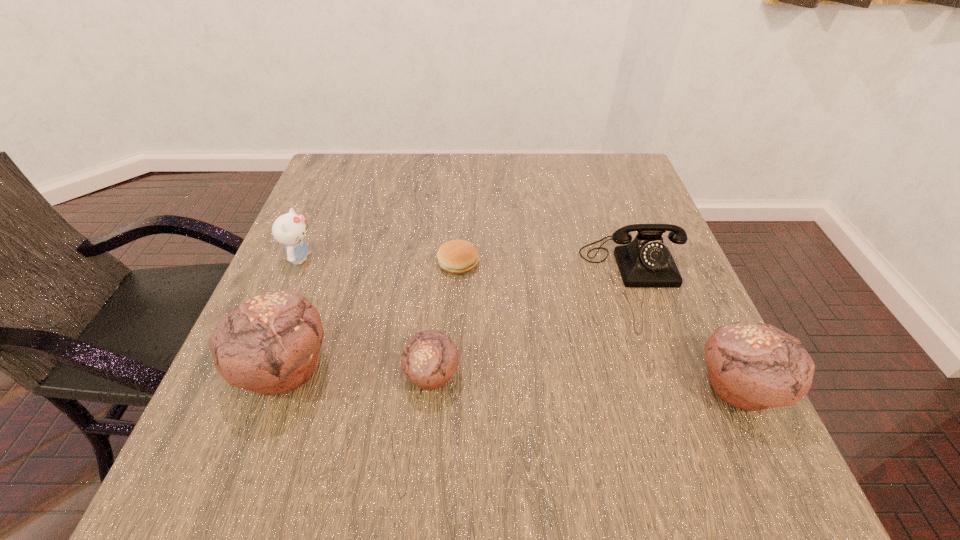
If equal spacing is desired by inserting an extra muffin among them, please point out a free spot for this new muffin. Please provide its 2D coordinates. Your answer should be formatted as a tuple, i.e. [(x, y)], where the tuple contains the x and y coordinates of a point satisfying the conditions above.

[(584, 381)]